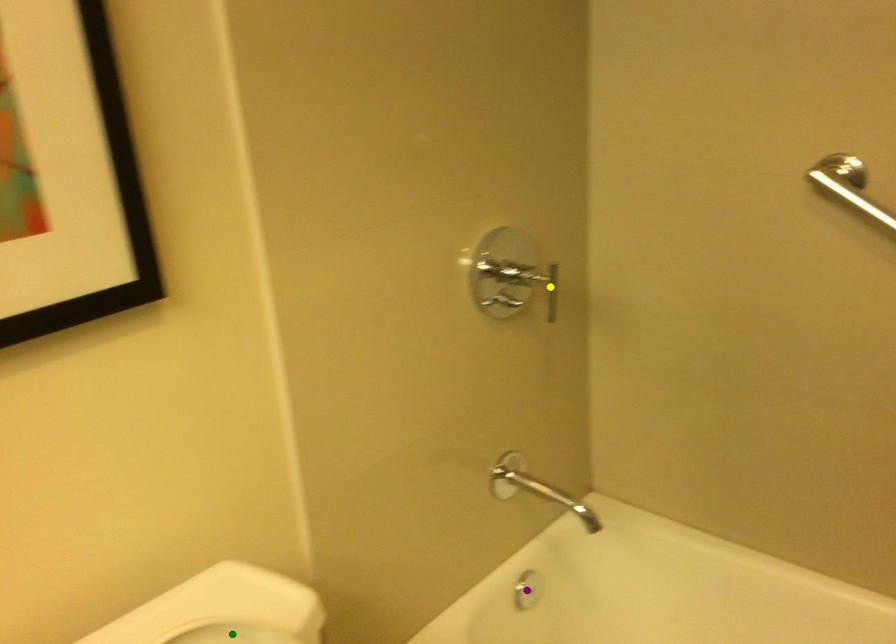
Order these from nearest to farthest:
purple point | yellow point | green point

green point < yellow point < purple point